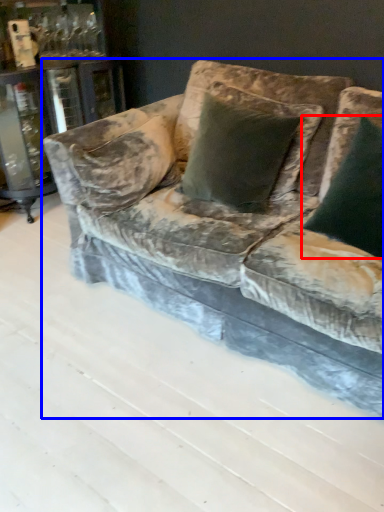
Question: Among these objects, which one is nearest to the camera, pillow (highlighted by a red box) or studio couch (highlighted by a blue box)?

Choices:
 (A) pillow
 (B) studio couch

Answer: (B)